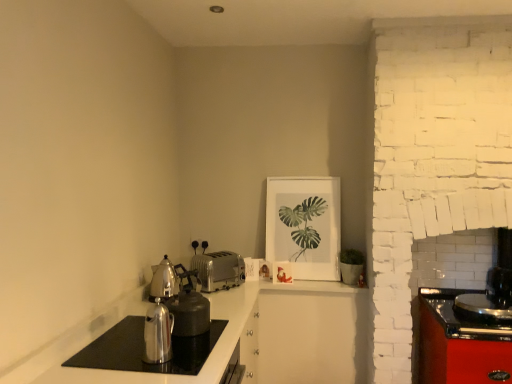
Question: Considering the relative positions of matte white picture frame at upper center and satin silver teapot at left in the image provided, is matte white picture frame at upper center in front of satin silver teapot at left?

Choices:
 (A) yes
 (B) no

Answer: (B)

Question: Is matte white picture frame at upper center at the right side of satin silver teapot at left?

Choices:
 (A) yes
 (B) no

Answer: (A)

Question: Considering the relative sizes of matte white picture frame at upper center and satin silver teapot at left in the image provided, is matte white picture frame at upper center wider than satin silver teapot at left?

Choices:
 (A) yes
 (B) no

Answer: (B)

Question: Considering the relative positions of matte white picture frame at upper center and satin silver teapot at left in the image provided, is matte white picture frame at upper center to the left of satin silver teapot at left from the viewer's perspective?

Choices:
 (A) no
 (B) yes

Answer: (A)

Question: Would you consider matte white picture frame at upper center to be distant from satin silver teapot at left?

Choices:
 (A) yes
 (B) no

Answer: (B)

Question: Is matte white picture frame at upper center turned away from satin silver teapot at left?

Choices:
 (A) no
 (B) yes

Answer: (A)

Question: Is silver metallic toaster at center looking in the opposite direction of shiny metallic kettle at lower left?

Choices:
 (A) no
 (B) yes

Answer: (A)

Question: Can you confirm if silver metallic toaster at center is positioned to the left of shiny metallic kettle at lower left?

Choices:
 (A) yes
 (B) no

Answer: (B)

Question: Is silver metallic toaster at center outside shiny metallic kettle at lower left?

Choices:
 (A) yes
 (B) no

Answer: (A)

Question: Does silver metallic toaster at center touch shiny metallic kettle at lower left?

Choices:
 (A) no
 (B) yes

Answer: (A)

Question: Is the position of silver metallic toaster at center more distant than that of shiny metallic kettle at lower left?

Choices:
 (A) no
 (B) yes

Answer: (B)

Question: Is the position of silver metallic toaster at center less distant than that of shiny metallic kettle at lower left?

Choices:
 (A) yes
 (B) no

Answer: (B)

Question: Does satin silver teapot at left have a smaller size compared to silver metallic toaster at center?

Choices:
 (A) yes
 (B) no

Answer: (A)